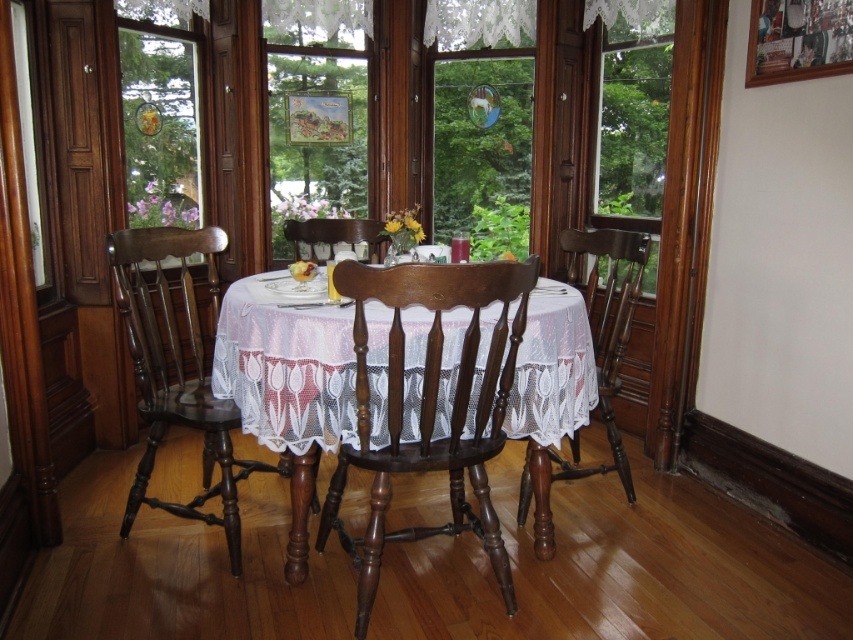
Looking at this image, you are sitting at the wooden chair at center in the dining area. You want to look out through the clear glass window at center. Can you see the window directly in front of you?

The wooden chair at center is behind the clear glass window at center, so you can see the window directly in front of you.

You are standing in the room and want to check the weather outside. Where should you look to see through the clear glass window at center?

The clear glass window at center is located at point (482, 128), so you should look towards that coordinate to see outside.

You are arranging a dinner party and need to ensure that the clear glass window at center and the wooden chair at center are positioned correctly. Based on their sizes, which object occupies more horizontal space in the room?

The clear glass window at center is wider than the wooden chair at center, so it occupies more horizontal space in the room.